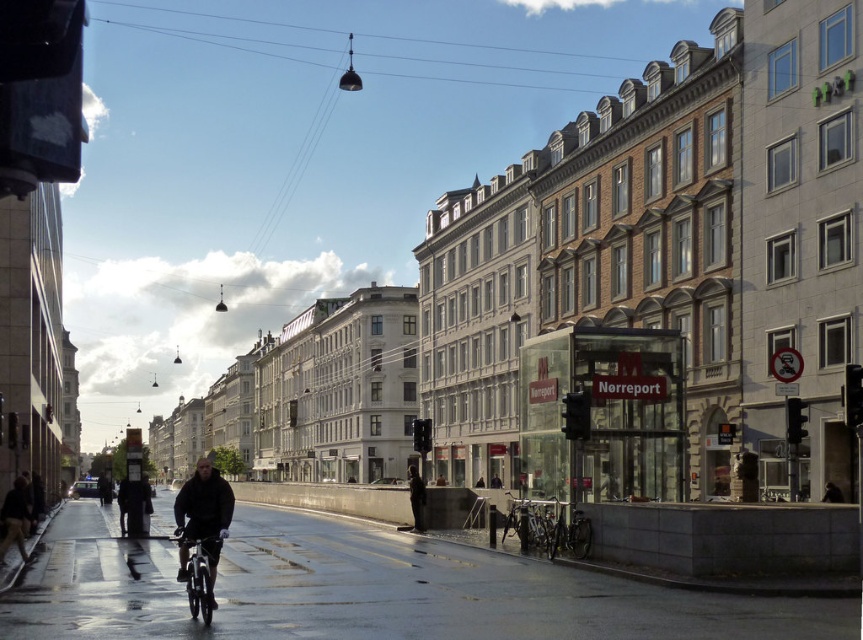
Question: Estimate the real-world distances between objects in this image. Which object is farther from the green matte bicycle at lower center?

Choices:
 (A) metallic silver bicycle at lower center
 (B) silver metallic bicycle at lower right
 (C) dark gray jacket at center

Answer: (A)

Question: Among these objects, which one is nearest to the camera?

Choices:
 (A) metallic silver bicycle at lower center
 (B) dark gray jacket at center
 (C) green matte bicycle at lower center

Answer: (A)

Question: Is metallic silver bicycle at lower center wider than silver metallic bicycle at lower right?

Choices:
 (A) yes
 (B) no

Answer: (A)

Question: Where is dark matte jacket at lower left located in relation to green matte bicycle at lower center in the image?

Choices:
 (A) right
 (B) left

Answer: (B)

Question: Considering the real-world distances, which object is closest to the dark gray jacket at center?

Choices:
 (A) green matte bicycle at lower center
 (B) metallic silver bicycle at lower center
 (C) dark matte jacket at lower left
 (D) silver metallic bicycle at lower right

Answer: (D)

Question: Is metallic silver bicycle at lower center smaller than green matte bicycle at lower center?

Choices:
 (A) yes
 (B) no

Answer: (B)